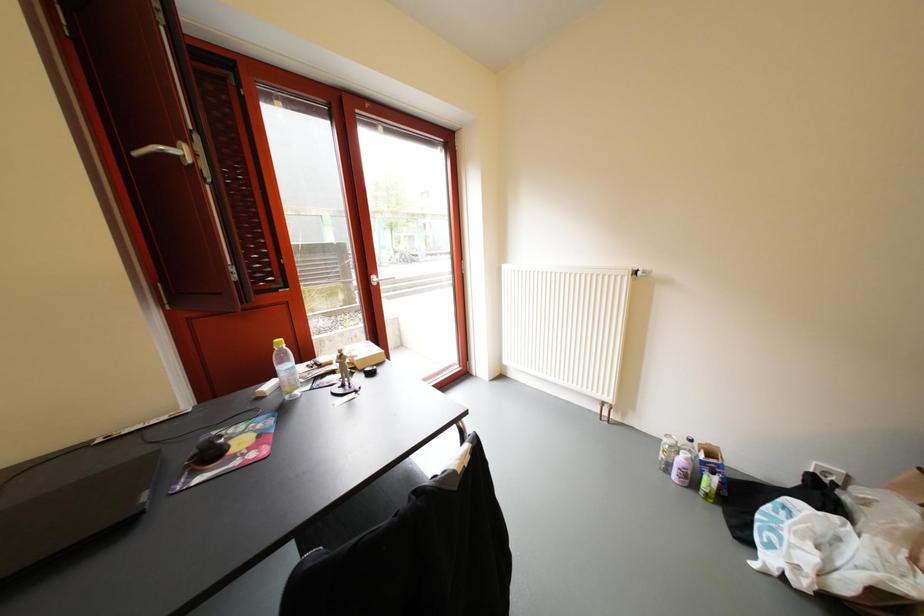
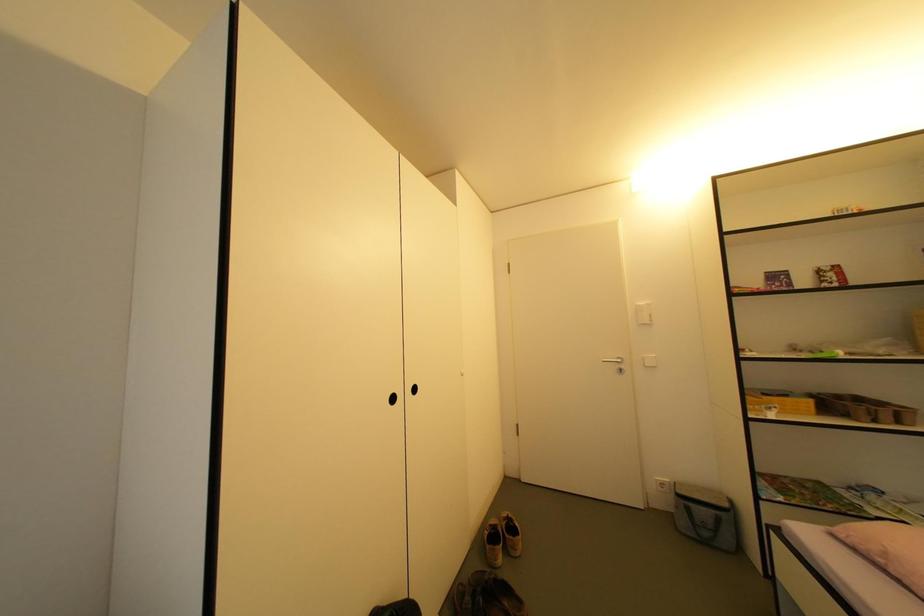
Question: The camera is either moving clockwise (left) or counter-clockwise (right) around the object. The first image is from the beginning of the video and the second image is from the end. Is the camera moving left or right when shooting the video?

Choices:
 (A) Left
 (B) Right

Answer: (A)